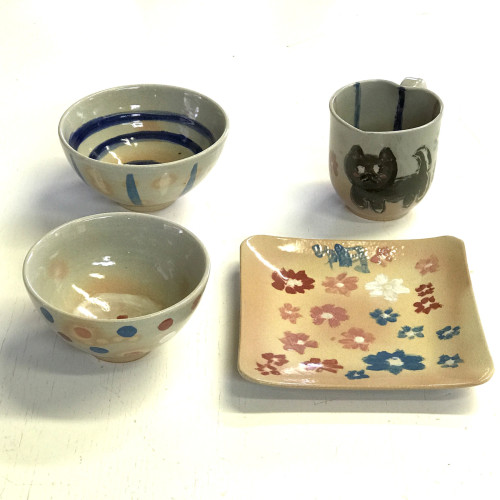
You are a GUI agent. You are given a task and a screenshot of the screen. Output one action in this format:
    pyautogui.click(x=<x>, y=<y>)
    Task: Click on the cup
    Image resolution: width=500 pixels, height=500 pixels.
    Given the screenshot: What is the action you would take?
    pyautogui.click(x=386, y=107)